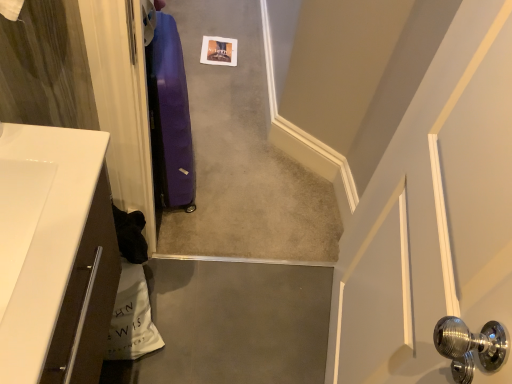
Question: Is the depth of purple fabric suitcase at center less than that of purple fabric suitcase at left?

Choices:
 (A) yes
 (B) no

Answer: (B)

Question: Are purple fabric suitcase at center and purple fabric suitcase at left located far from each other?

Choices:
 (A) yes
 (B) no

Answer: (B)

Question: From a real-world perspective, is purple fabric suitcase at center physically above purple fabric suitcase at left?

Choices:
 (A) no
 (B) yes

Answer: (A)

Question: Can you confirm if purple fabric suitcase at center is taller than purple fabric suitcase at left?

Choices:
 (A) yes
 (B) no

Answer: (B)

Question: Is purple fabric suitcase at center to the right of purple fabric suitcase at left from the viewer's perspective?

Choices:
 (A) no
 (B) yes

Answer: (B)

Question: Would you say purple fabric suitcase at left is to the left or to the right of white glossy countertop at lower left in the picture?

Choices:
 (A) right
 (B) left

Answer: (A)

Question: Considering the positions of point (155, 34) and point (61, 319), is point (155, 34) closer or farther from the camera than point (61, 319)?

Choices:
 (A) closer
 (B) farther

Answer: (B)

Question: Would you say purple fabric suitcase at left is inside or outside white glossy countertop at lower left?

Choices:
 (A) outside
 (B) inside

Answer: (A)

Question: Is purple fabric suitcase at left bigger or smaller than white glossy countertop at lower left?

Choices:
 (A) small
 (B) big

Answer: (B)

Question: Looking at their shapes, would you say purple fabric suitcase at left is wider or thinner than purple fabric suitcase at center?

Choices:
 (A) wide
 (B) thin

Answer: (B)

Question: Is purple fabric suitcase at left in front of or behind purple fabric suitcase at center in the image?

Choices:
 (A) front
 (B) behind

Answer: (A)

Question: Choose the correct answer: Is purple fabric suitcase at left inside purple fabric suitcase at center or outside it?

Choices:
 (A) outside
 (B) inside

Answer: (A)

Question: From a real-world perspective, is purple fabric suitcase at left above or below purple fabric suitcase at center?

Choices:
 (A) below
 (B) above

Answer: (B)

Question: From the image's perspective, relative to purple fabric suitcase at left, is purple fabric suitcase at center above or below?

Choices:
 (A) above
 (B) below

Answer: (A)

Question: Considering the positions of purple fabric suitcase at center and purple fabric suitcase at left in the image, is purple fabric suitcase at center wider or thinner than purple fabric suitcase at left?

Choices:
 (A) thin
 (B) wide

Answer: (B)